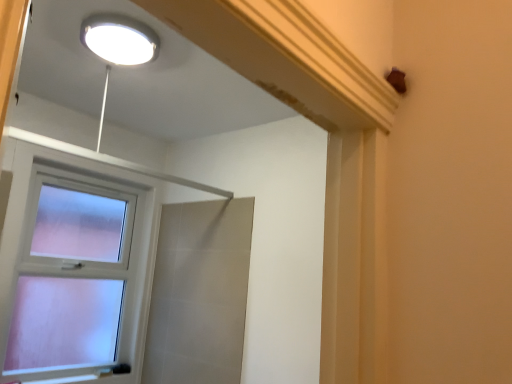
This screenshot has width=512, height=384. Describe the element at coordinates (199, 293) in the screenshot. I see `beige fabric screen door at center` at that location.

Where is `beige fabric screen door at center`? This screenshot has width=512, height=384. beige fabric screen door at center is located at coordinates (199, 293).

Find the location of a particular element. The image size is (512, 384). beige fabric screen door at center is located at coordinates (199, 293).